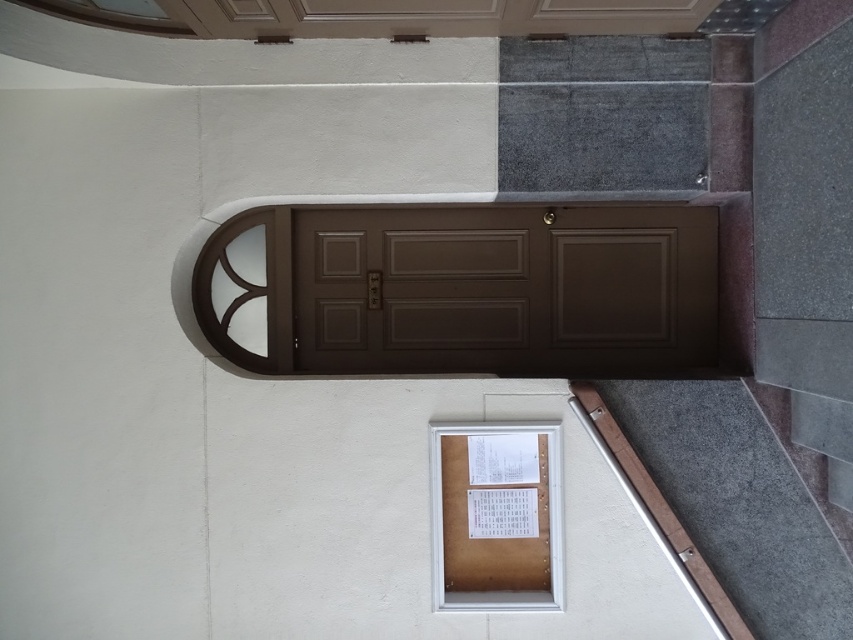
You are a delivery person trying to enter the building. You see the brown matte door at center and the gray carpet at lower right. Which object is wider?

The brown matte door at center is wider than the gray carpet at lower right according to the description.

You are standing in front of the building and see two points marked on the wall. The first point is at coordinates point (467, 332) and the second is at point (552, 500). Which point is closer to you?

Point (552, 500) is closer to you because point (467, 332) is behind it.

You are standing at the camera position and want to place a 2 meter long object on the floor. Is there enough space between you and the gray carpet at lower right to do so?

The gray carpet at lower right is 4.42 meters from the camera, so placing a 2 meter long object between you and the gray carpet at lower right would leave sufficient space since 4.42 meters is greater than 2 meters.